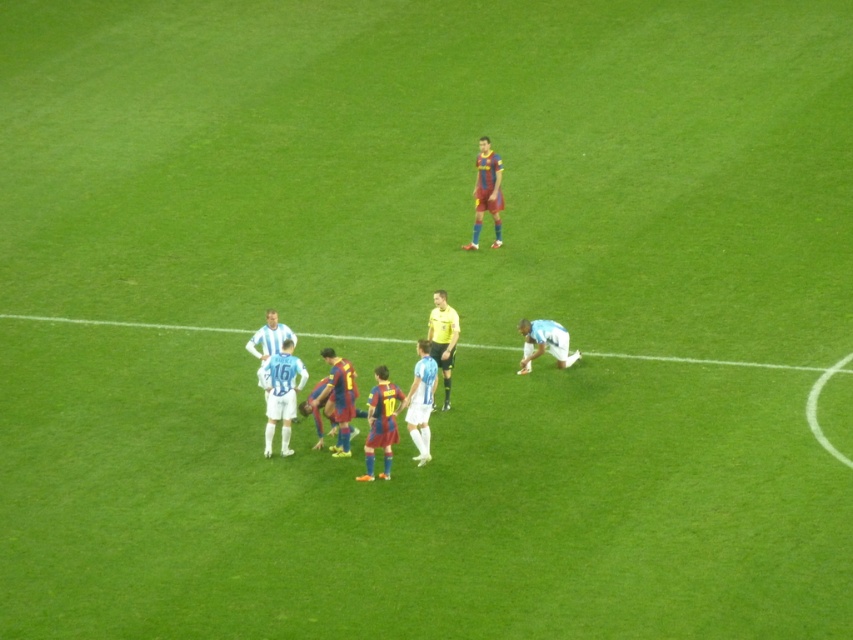
Which is more to the left, white fabric line at lower center or maroon jersey at upper center?

From the viewer's perspective, white fabric line at lower center appears more on the left side.

In order to click on white fabric line at lower center in this screenshot , I will do [724, 362].

Between maroon jersey at upper center and light blue jersey at center, which one is positioned higher?

Positioned higher is maroon jersey at upper center.

Is point (480, 196) farther from viewer compared to point (258, 349)?

Yes, point (480, 196) is behind point (258, 349).

I want to click on maroon jersey at upper center, so click(486, 193).

Who is higher up, white fabric line at lower center or white matte jersey at lower right?

white fabric line at lower center is above.

From the picture: Measure the distance between white fabric line at lower center and camera.

54.70 feet

In order to click on white fabric line at lower center in this screenshot , I will do `click(724, 362)`.